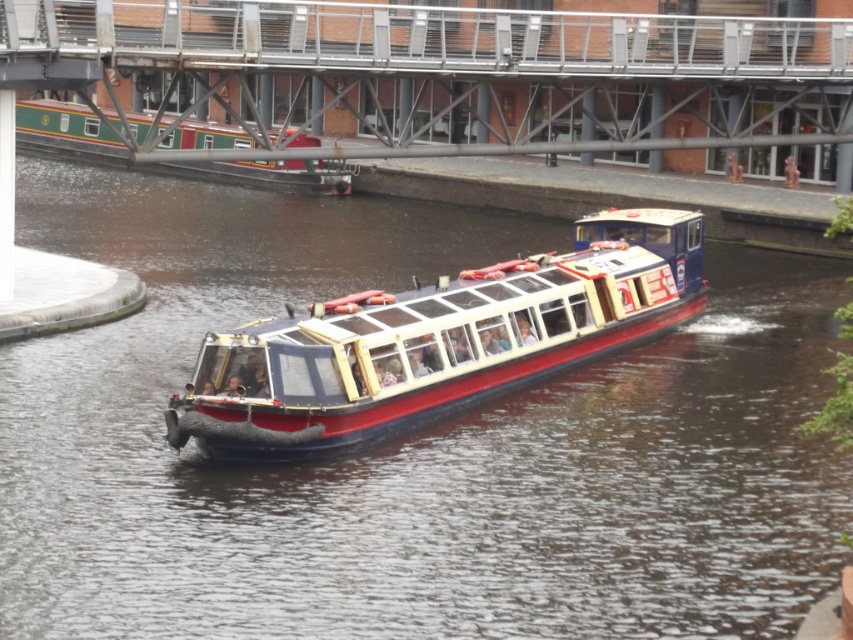
You are standing at the point with coordinates [442,81] in the canal scene. What object is located exactly at your current position?

The metallic gray bridge at upper center is located exactly at point [442,81].

You are planning to navigate a narrowboat through a lock that can only accommodate boats up to the width of the green polished wood boat at upper left. Can the red polished wood boat at center safely pass through the lock?

The red polished wood boat at center is narrower than the green polished wood boat at upper left, so it can safely pass through the lock designed for the green boat.

You are a passenger on the green polished wood boat at upper left and want to disembark at the metallic gray bridge at upper center. Which direction should you move your boat to reach the bridge?

The metallic gray bridge at upper center is to the right of the green polished wood boat at upper left, so you should move your boat to the right to reach the bridge.